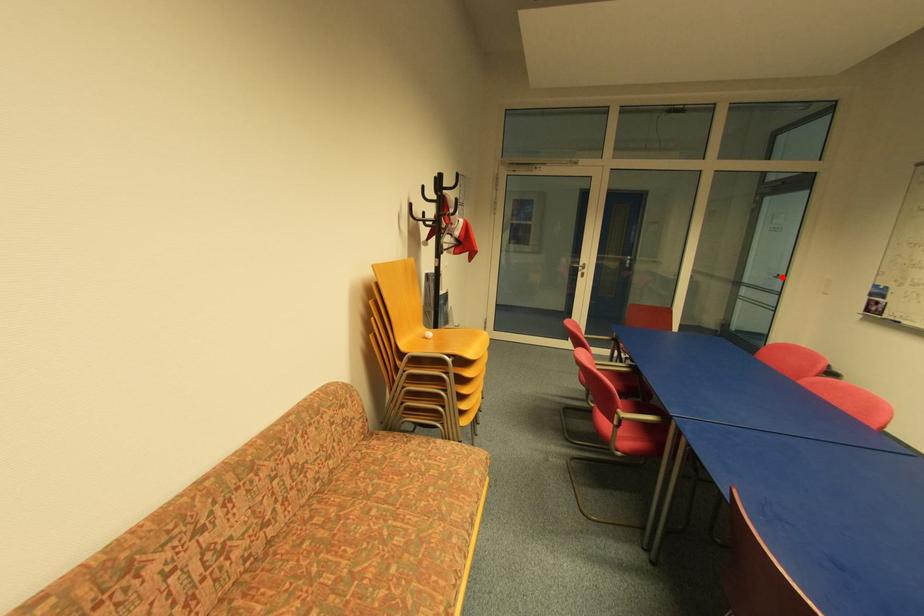
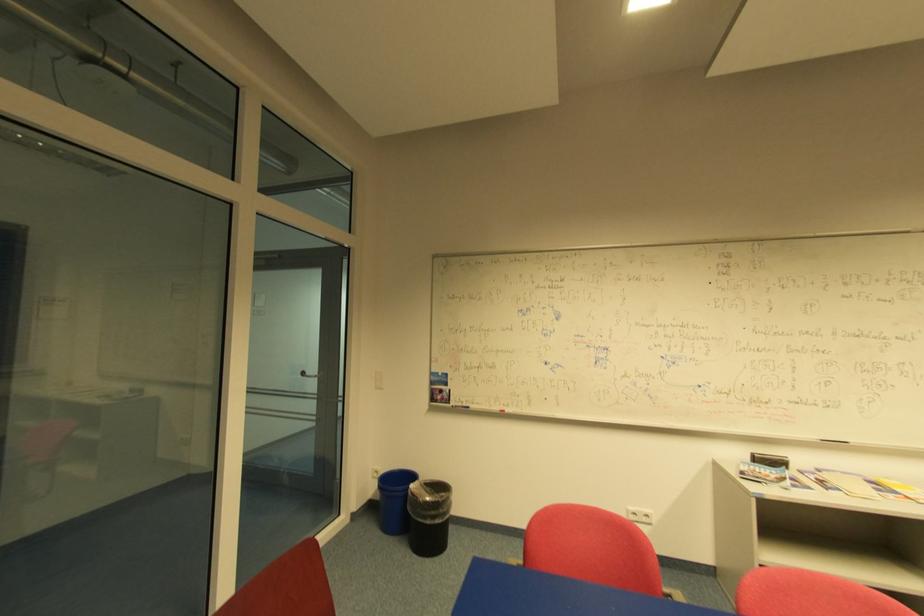
Question: I am providing you with two images of the same scene from different viewpoints. A red point is marked on the first image. Is the red point's position out of view in image 2?

Choices:
 (A) Yes
 (B) No

Answer: (B)